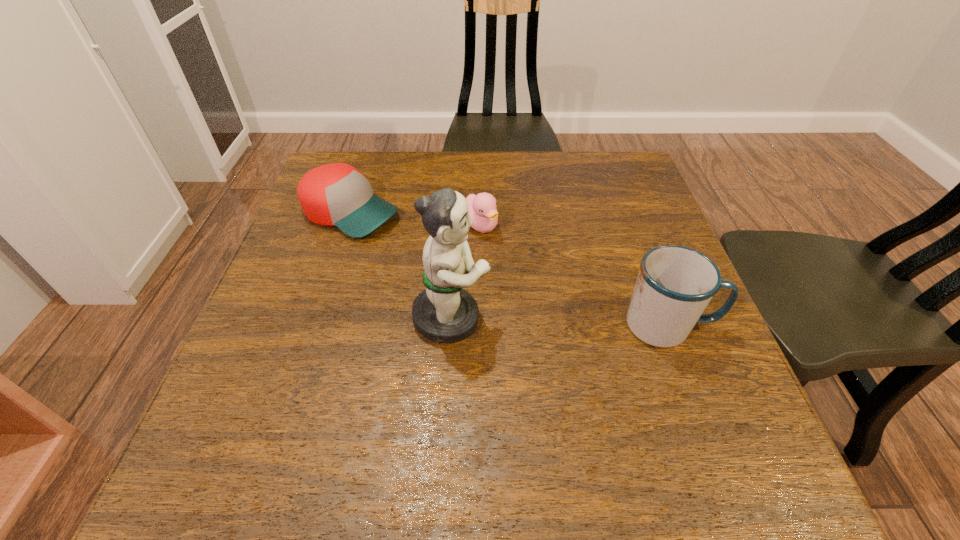
What are the coordinates of `vacant space on the desktop that is between the figurine and the rightmost object and is positioned at the brim of the leftmost object` in the screenshot? It's located at (589, 322).

This screenshot has width=960, height=540. I want to click on free space on the desktop that is between the tallest object and the rightmost object and is positioned on the front-facing side of the duckling, so [x=589, y=322].